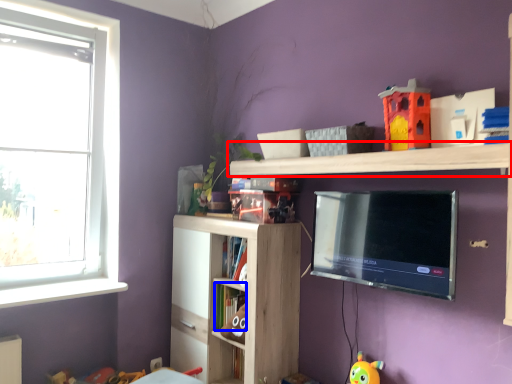
Question: Which of the following is the closest to the observer, shelf (highlighted by a red box) or book (highlighted by a blue box)?

Choices:
 (A) shelf
 (B) book

Answer: (A)